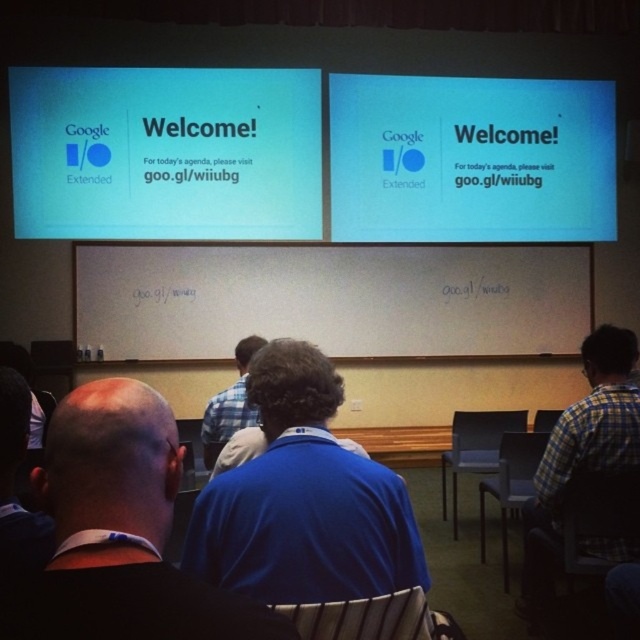
You are sitting in the back row of the conference room and want to get a better view of the presentation screen. You notice two chairs in front of you labeled gray plastic chair at center and matte plastic chair at center. Which chair should you move past to get closer to the screen?

You should move past the gray plastic chair at center first because it is closer to you than the matte plastic chair at center, so moving past it will bring you closer to the screen.

You are an event organizer trying to rearrange the seating for a larger audience. You need to know if the blue fabric shirt at center can fit sideways into the space currently occupied by the black plastic chair at lower right. Can you confirm if this is possible?

The blue fabric shirt at center might be wider than black plastic chair at lower right, so there is uncertainty about whether it can fit sideways into the space. Further measurement or adjustment may be needed.

You are an event organizer and need to ensure that all attendees can see the presentation screen clearly. Considering the blue fabric shirt at center and the black plastic chair at lower right, which object is shorter and might block someone sitting behind it?

The blue fabric shirt at center is not as tall as the black plastic chair at lower right, so the blue fabric shirt at center is shorter and might block someone sitting behind it.